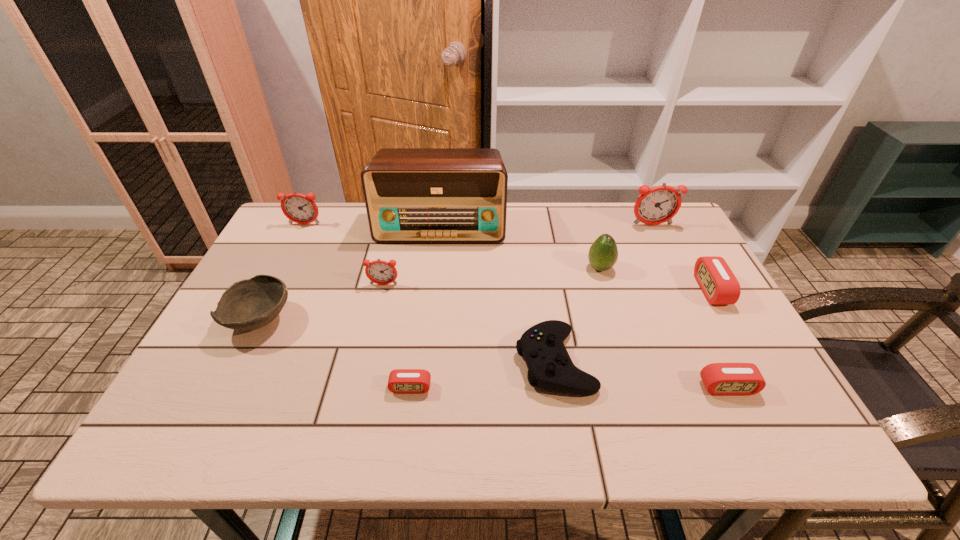
Where is `the tallest object`? the tallest object is located at coordinates (412, 195).

Identify the location of the rightmost reddish-pink alarm clock. The image size is (960, 540). (659, 204).

You are a GUI agent. You are given a task and a screenshot of the screen. Output one action in this format:
    pyautogui.click(x=<x>, y=<y>)
    Task: Click on the biggest reddish-pink alarm clock
    This screenshot has width=960, height=540.
    Given the screenshot: What is the action you would take?
    pyautogui.click(x=659, y=204)

The image size is (960, 540). I want to click on the second biggest reddish-pink alarm clock, so click(298, 208).

The image size is (960, 540). In order to click on the leftmost alarm clock in this screenshot , I will do `click(298, 208)`.

Find the location of a particular element. avocado is located at coordinates (603, 254).

The image size is (960, 540). What are the coordinates of `the fourth object from right to left` in the screenshot? It's located at (603, 254).

The width and height of the screenshot is (960, 540). Identify the location of the smallest reddish-pink alarm clock. (381, 272).

You are a GUI agent. You are given a task and a screenshot of the screen. Output one action in this format:
    pyautogui.click(x=<x>, y=<y>)
    Task: Click on the nearest reddish-pink alarm clock
    The image size is (960, 540).
    Given the screenshot: What is the action you would take?
    pyautogui.click(x=381, y=272)

The height and width of the screenshot is (540, 960). I want to click on bowl, so click(x=249, y=304).